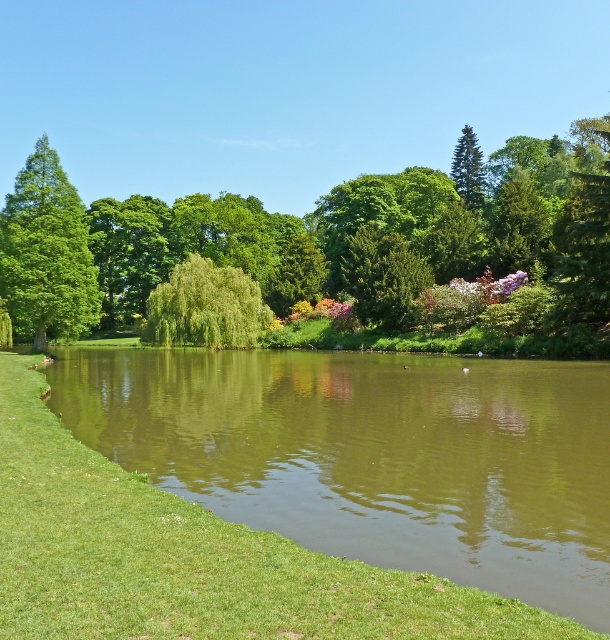
Which is in front, point (459, 454) or point (475, 145)?

Point (459, 454) is in front.

The height and width of the screenshot is (640, 610). Find the location of `green reflective water at center`. green reflective water at center is located at coordinates (373, 456).

You are a GUI agent. You are given a task and a screenshot of the screen. Output one action in this format:
    pyautogui.click(x=<x>, y=<y>)
    Task: Click on the green reflective water at center
    The image size is (610, 640).
    Given the screenshot: What is the action you would take?
    pyautogui.click(x=373, y=456)

I want to click on green reflective water at center, so click(x=373, y=456).

Identify the location of green reflective water at center. (373, 456).

Who is lower down, green reflective water at center or green leafy tree at center?

green reflective water at center is lower down.

At what (x,y) coordinates should I click in order to perform the action: click on green reflective water at center. Please return your answer as a coordinate pair (x, y). The height and width of the screenshot is (640, 610). Looking at the image, I should click on (373, 456).

The height and width of the screenshot is (640, 610). Find the location of `green reflective water at center`. green reflective water at center is located at coordinates (373, 456).

Does green leafy tree at center appear under green glossy tree at upper left?

Incorrect, green leafy tree at center is not positioned below green glossy tree at upper left.

Image resolution: width=610 pixels, height=640 pixels. What are the coordinates of `green leafy tree at center` in the screenshot? It's located at (386, 237).